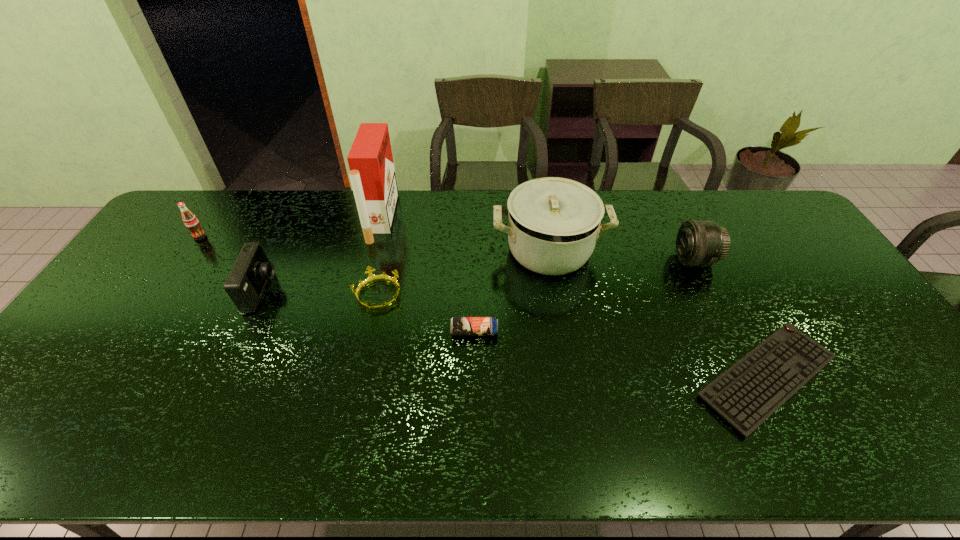
Locate an element on the screen. empty space that is in between the seventh shortest object and the camera is located at coordinates (406, 271).

Where is `vacant area that lies between the camera and the beer can`? Image resolution: width=960 pixels, height=540 pixels. vacant area that lies between the camera and the beer can is located at coordinates (369, 312).

The height and width of the screenshot is (540, 960). I want to click on vacant region between the cigarette case and the leftmost object, so click(291, 227).

The height and width of the screenshot is (540, 960). Find the location of `free space between the beer can and the saucepan`. free space between the beer can and the saucepan is located at coordinates 512,291.

Locate an element on the screen. This screenshot has width=960, height=540. free space between the second tallest object and the shortest object is located at coordinates (658, 314).

Locate an element on the screen. Image resolution: width=960 pixels, height=540 pixels. free point between the seventh object from right to left and the saucepan is located at coordinates (406, 271).

At what (x,y) coordinates should I click in order to perform the action: click on vacant space that's between the cigarette case and the leftmost object. Please return your answer as a coordinate pair (x, y). The width and height of the screenshot is (960, 540). Looking at the image, I should click on pyautogui.click(x=291, y=227).

This screenshot has width=960, height=540. I want to click on free space between the cigarette case and the second object from left to right, so click(322, 255).

Identify the location of free area in between the shortest object and the crown. (572, 336).

Find the location of `object identified as the second closest to the telephoto lens`. object identified as the second closest to the telephoto lens is located at coordinates (553, 223).